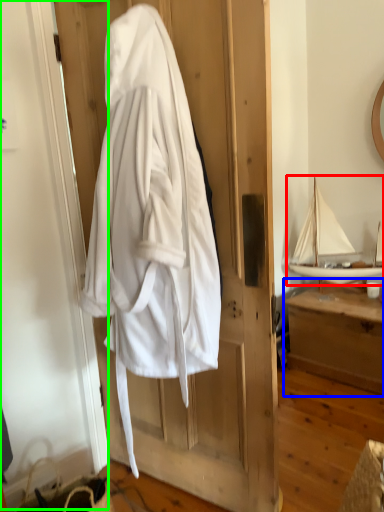
Question: Estimate the real-world distances between objects in this image. Which object is farther from boat (highlighted by a red box), furniture (highlighted by a blue box) or screen door (highlighted by a green box)?

Choices:
 (A) furniture
 (B) screen door

Answer: (B)